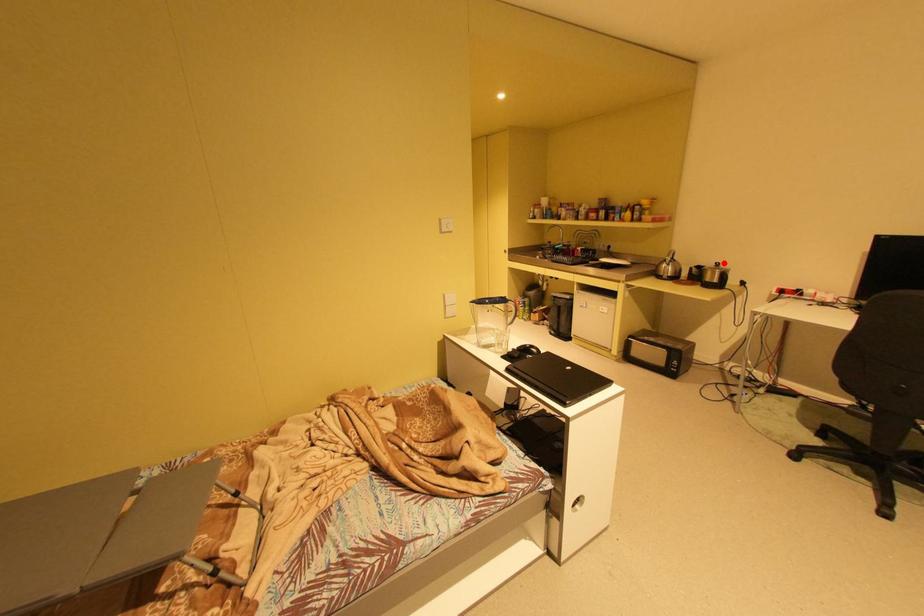
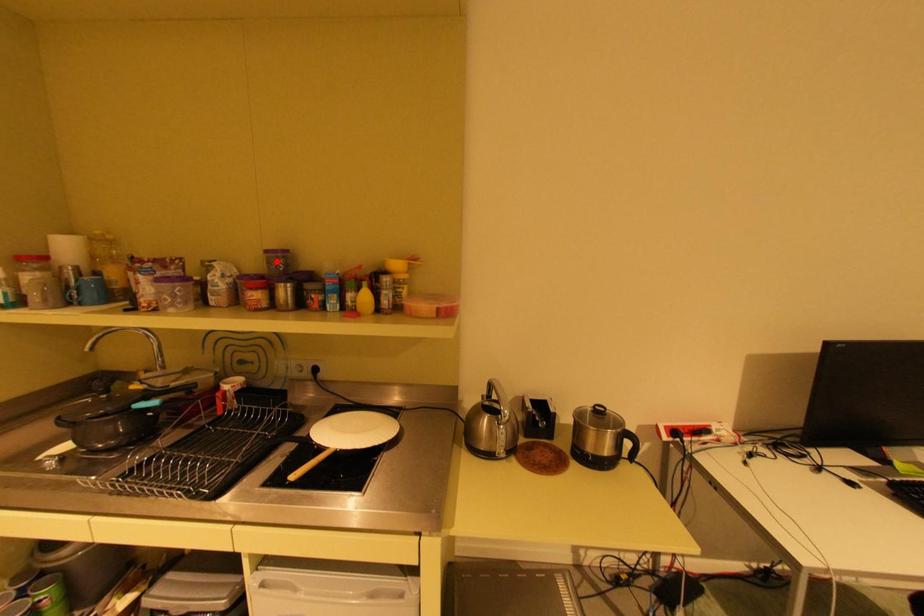
I am providing you with two images of the same scene from different viewpoints. A red point is marked on the first image and another point is marked on the second image. Are the points marked in image1 and image2 representing the same 3D position?

No